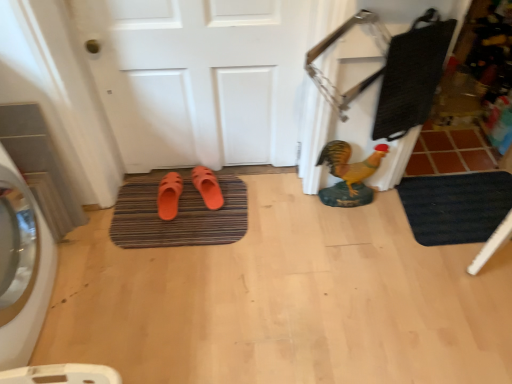
The width and height of the screenshot is (512, 384). In order to click on vacant region to the left of black rubber bath mat at lower right, positioned as the first bath mat in right-to-left order in this screenshot , I will do `click(376, 240)`.